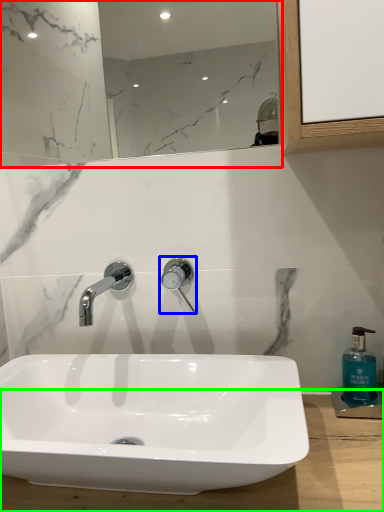
Question: Which is farther away from mirror (highlighted by a red box)? tap (highlighted by a blue box) or counter top (highlighted by a green box)?

Choices:
 (A) tap
 (B) counter top

Answer: (B)